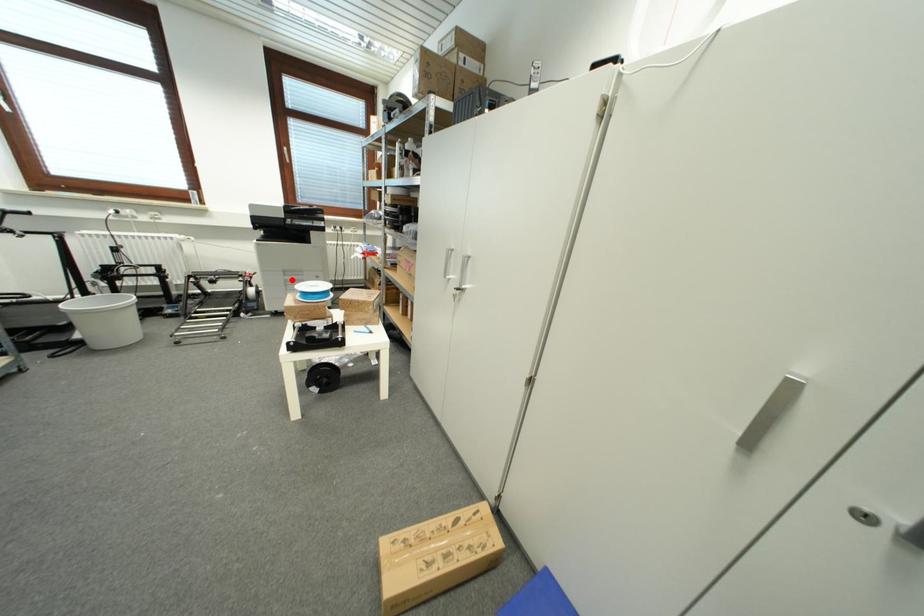
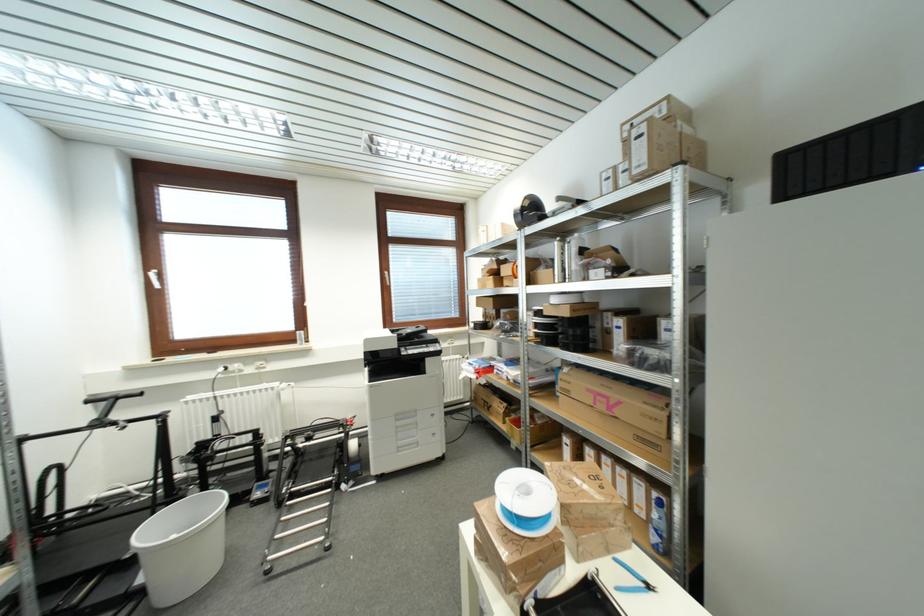
Question: I am providing you with two images of the same scene from different viewpoints. In image1, a red point is highlighted. Considering the same 3D point in image2, which of the following is correct?

Choices:
 (A) It is closer
 (B) It is farther

Answer: (A)